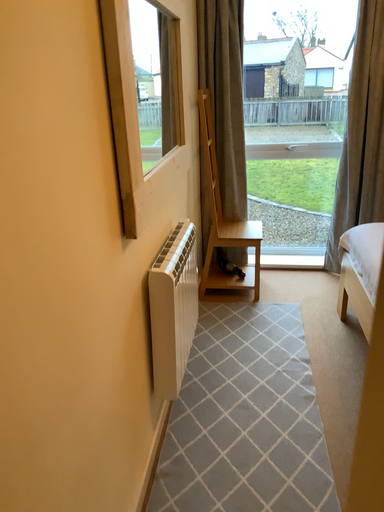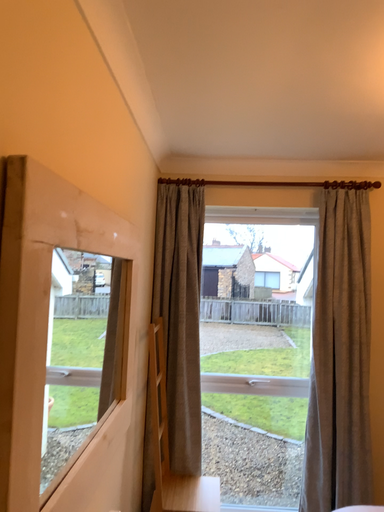
Question: Which way did the camera rotate in the video?

Choices:
 (A) rotated downward
 (B) rotated upward

Answer: (B)